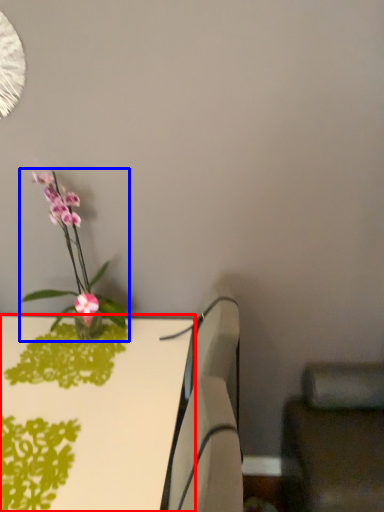
Question: Which object is further to the camera taking this photo, table (highlighted by a red box) or houseplant (highlighted by a blue box)?

Choices:
 (A) table
 (B) houseplant

Answer: (B)